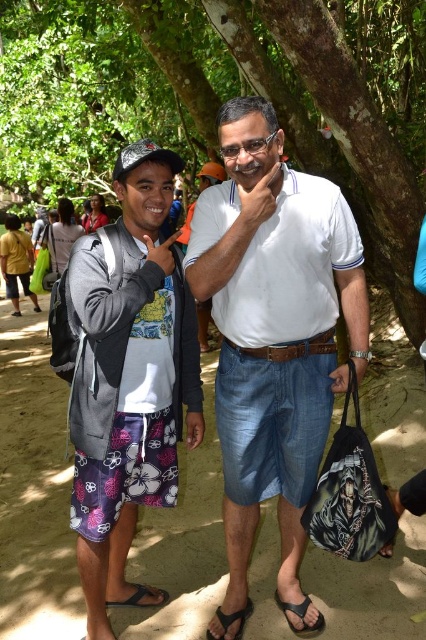
How much distance is there between rough bark tree at center and black synthetic sandal at lower center?

rough bark tree at center is 15.96 meters away from black synthetic sandal at lower center.

Is point (123, 20) positioned before point (302, 612)?

No, it is not.

Who is more forward, (376, 19) or (305, 612)?

Point (305, 612)

At what (x,y) coordinates should I click in order to perform the action: click on rough bark tree at center. Please return your answer as a coordinate pair (x, y). This screenshot has height=640, width=426. Looking at the image, I should click on (226, 99).

Does rough bark tree at center come in front of white cotton shirt at center?

No, rough bark tree at center is further to the viewer.

Can you confirm if rough bark tree at center is thinner than white cotton shirt at center?

Incorrect, rough bark tree at center's width is not less than white cotton shirt at center's.

Identify the location of rough bark tree at center. (226, 99).

Is point (388, 180) positioned after point (146, 593)?

Yes.

Between rough bark tree at center and black rubber sandal at lower left, which one is positioned higher?

rough bark tree at center is higher up.

Between point (175, 12) and point (164, 595), which one is positioned in front?

Positioned in front is point (164, 595).

The height and width of the screenshot is (640, 426). Identify the location of rough bark tree at center. (226, 99).